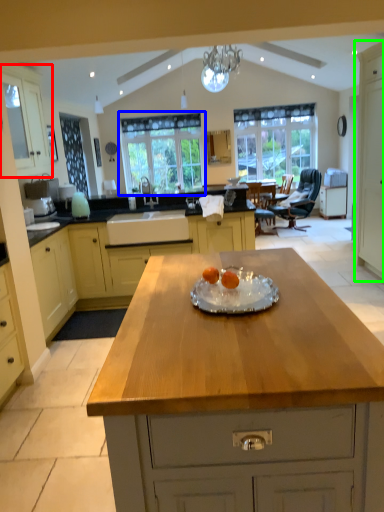
Question: Considering the real-world distances, which object is farthest from cabinetry (highlighted by a red box)? window (highlighted by a blue box) or cabinetry (highlighted by a green box)?

Choices:
 (A) window
 (B) cabinetry

Answer: (B)